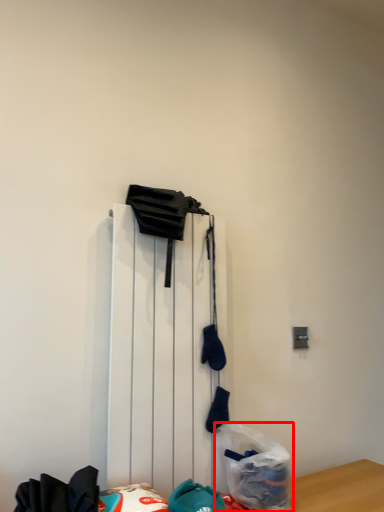
Question: In this image, where is plastic bag (annotated by the red box) located relative to radiator?

Choices:
 (A) left
 (B) right

Answer: (B)